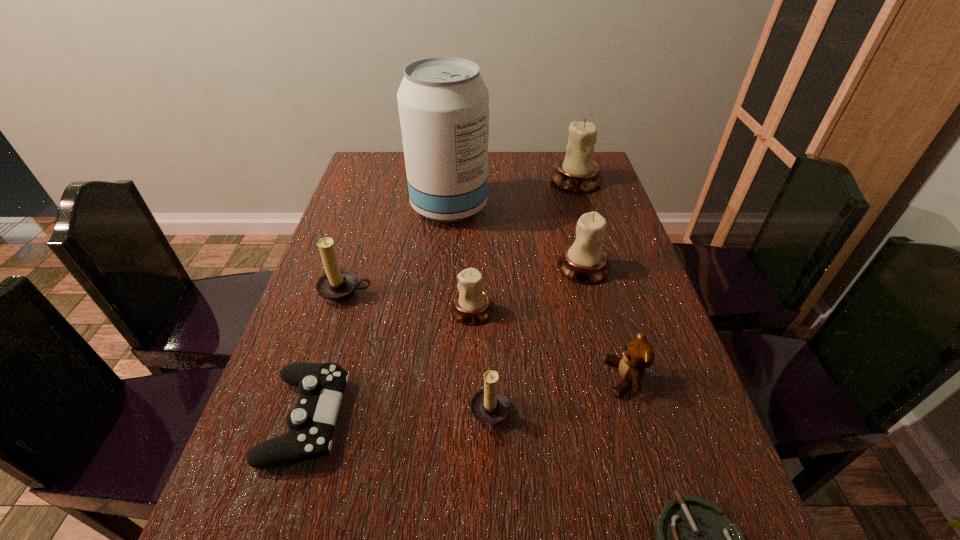
At what (x,y) coordinates should I click in order to perform the action: click on brown teddy bear. Please return your answer as a coordinate pair (x, y). Looking at the image, I should click on (639, 354).

At what (x,y) coordinates should I click in order to perform the action: click on the eighth tallest object. Please return your answer as a coordinate pair (x, y). This screenshot has width=960, height=540. Looking at the image, I should click on (321, 386).

Identify the location of control. Image resolution: width=960 pixels, height=540 pixels. (321, 386).

This screenshot has height=540, width=960. Identify the location of vacant region located on the right of the tallest object. (566, 207).

At what (x,y) coordinates should I click in order to perform the action: click on vacant space positioned on the left of the farthest candle holder. Please return your answer as a coordinate pair (x, y). The height and width of the screenshot is (540, 960). Looking at the image, I should click on (468, 180).

The image size is (960, 540). Identify the location of blank space located 0.180m on the left of the second farthest white candle holder. (488, 267).

At what (x,y) coordinates should I click in order to perform the action: click on blank area located 0.160m on the wick of the farther brown candle holder. Please return your answer as a coordinate pair (x, y). The image size is (960, 540). Looking at the image, I should click on (324, 363).

Identify the location of free space located on the right of the nearest white candle holder. This screenshot has width=960, height=540. (656, 310).

At what (x,y) coordinates should I click in order to perform the action: click on vacant region located on the wick of the nearer brown candle holder. Please return your answer as a coordinate pair (x, y). This screenshot has height=540, width=960. Looking at the image, I should click on (375, 417).

Where is `free space located on the wick of the nearer brown candle holder`? The width and height of the screenshot is (960, 540). free space located on the wick of the nearer brown candle holder is located at coordinates (x=311, y=417).